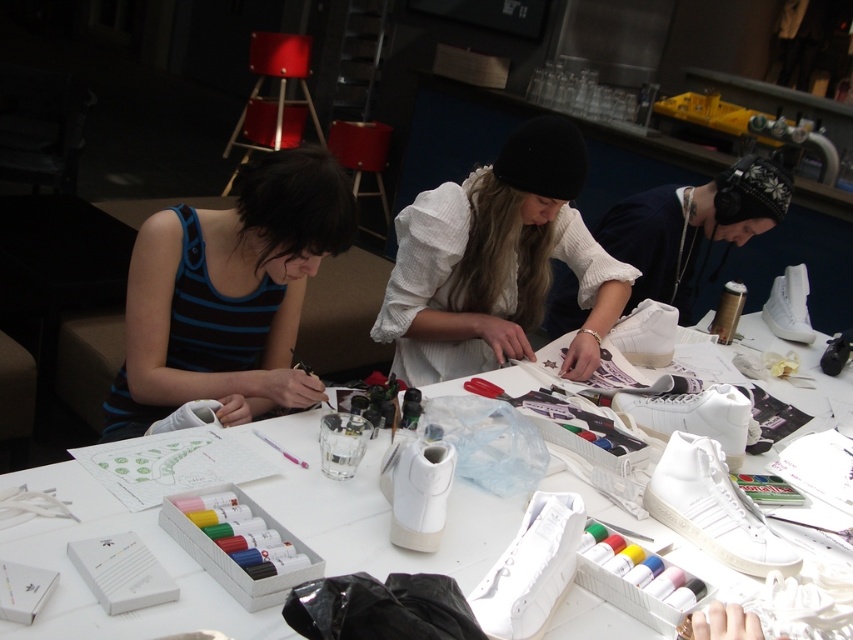
From the picture: You are standing at the origin point of the coordinate system in the image. The white matte sneakers at center are located at point 0.797, 0.435. If you want to move towards them, in which direction should you move?

The white matte sneakers at center are located at point (370, 509), so you should move towards the positive x and positive y directions to reach them.

You are organizing a shoe display and need to place the white matte sneakers at center and the white matte sneaker at center next to each other. Which one should you place on the left to maintain proper size order from largest to smallest?

You should place the white matte sneakers at center on the left since it is larger in size than the white matte sneaker at center, ensuring the size order from largest to smallest.

You are organizing a shoe customization event and need to arrange items on the table. The white cotton shirt at center is currently blocking access to the white matte sneaker at center. To free up space, which item should you move to the right to make the sneaker more accessible?

The white cotton shirt at center is to the left of the white matte sneaker at center, so moving the white cotton shirt at center to the right would allow better access to the sneaker.